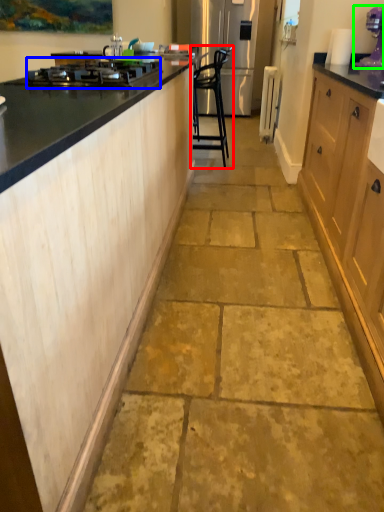
Question: Based on their relative distances, which object is farther from chair (highlighted by a red box)? Choose from home appliance (highlighted by a blue box) and kitchen appliance (highlighted by a green box).

Choices:
 (A) home appliance
 (B) kitchen appliance

Answer: (A)